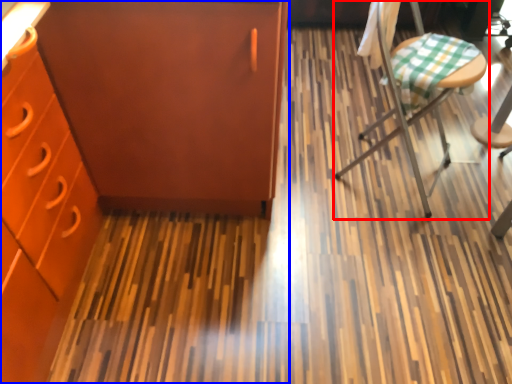
Question: Which of the following is the closest to the observer, chair (highlighted by a red box) or cabinetry (highlighted by a blue box)?

Choices:
 (A) chair
 (B) cabinetry

Answer: (B)